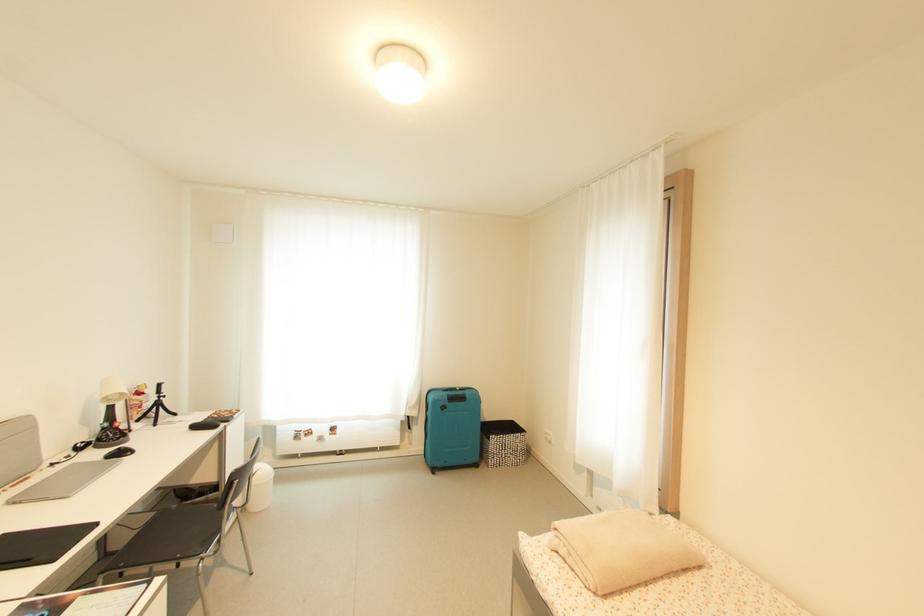
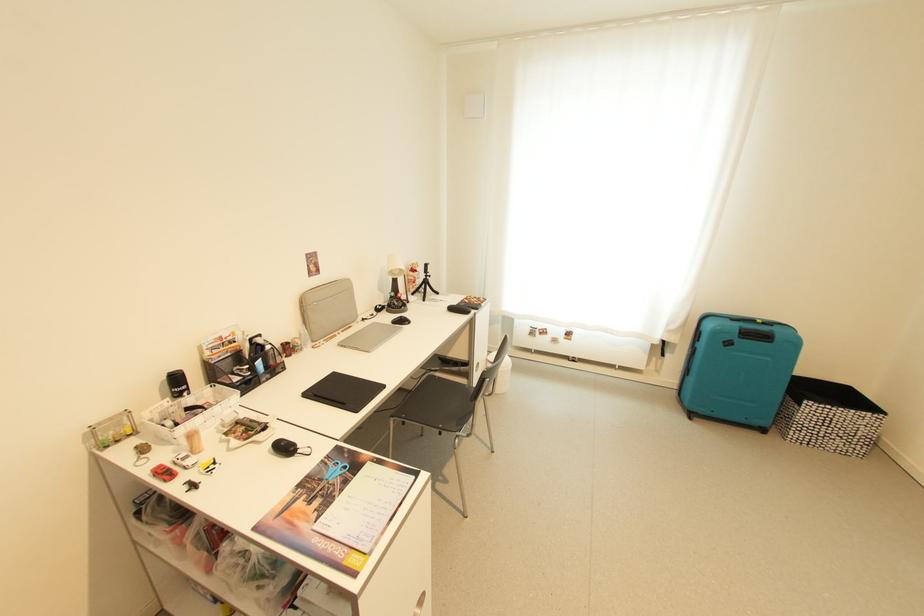
First-person continuous shooting, in which direction is the camera rotating?

The camera rotated toward left-down.